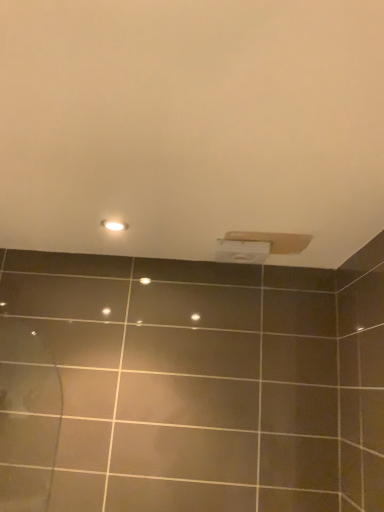
Question: Relative to matte white light fixture at upper center, is white matte toilet paper at upper center in front or behind?

Choices:
 (A) front
 (B) behind

Answer: (B)

Question: In terms of size, does white matte toilet paper at upper center appear bigger or smaller than matte white light fixture at upper center?

Choices:
 (A) small
 (B) big

Answer: (B)

Question: Visually, is white matte toilet paper at upper center positioned to the left or to the right of matte white light fixture at upper center?

Choices:
 (A) left
 (B) right

Answer: (B)

Question: Which is correct: matte white light fixture at upper center is inside white matte toilet paper at upper center, or outside of it?

Choices:
 (A) outside
 (B) inside

Answer: (A)

Question: In terms of height, does matte white light fixture at upper center look taller or shorter compared to white matte toilet paper at upper center?

Choices:
 (A) short
 (B) tall

Answer: (A)

Question: Is matte white light fixture at upper center bigger or smaller than white matte toilet paper at upper center?

Choices:
 (A) small
 (B) big

Answer: (A)

Question: Is point (110, 225) positioned closer to the camera than point (240, 256)?

Choices:
 (A) closer
 (B) farther

Answer: (A)